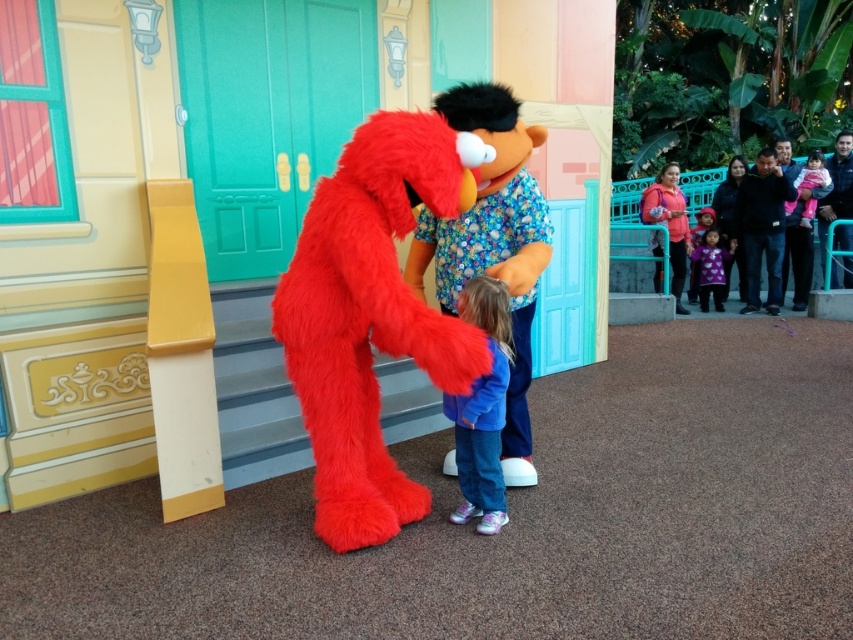
Does blue denim jeans at center come in front of purple dotted dress at center?

Yes, it is in front of purple dotted dress at center.

Which is behind, point (456, 406) or point (718, 285)?

Positioned behind is point (718, 285).

This screenshot has height=640, width=853. Find the location of `blue denim jeans at center`. blue denim jeans at center is located at coordinates (482, 410).

Does point (676, 307) lie in front of point (799, 177)?

No, it is not.

Can you confirm if matte pink hoodie at upper right is positioned to the left of soft pink fabric at upper right?

Yes, matte pink hoodie at upper right is to the left of soft pink fabric at upper right.

Describe the element at coordinates (669, 221) in the screenshot. This screenshot has height=640, width=853. I see `matte pink hoodie at upper right` at that location.

The image size is (853, 640). I want to click on matte pink hoodie at upper right, so click(x=669, y=221).

Is fuzzy red elmo at left above soft pink fabric at upper right?

No, fuzzy red elmo at left is not above soft pink fabric at upper right.

Can you confirm if fuzzy red elmo at left is positioned to the right of soft pink fabric at upper right?

No, fuzzy red elmo at left is not to the right of soft pink fabric at upper right.

The image size is (853, 640). I want to click on fuzzy red elmo at left, so click(369, 317).

Identify the location of fuzzy red elmo at left. (369, 317).